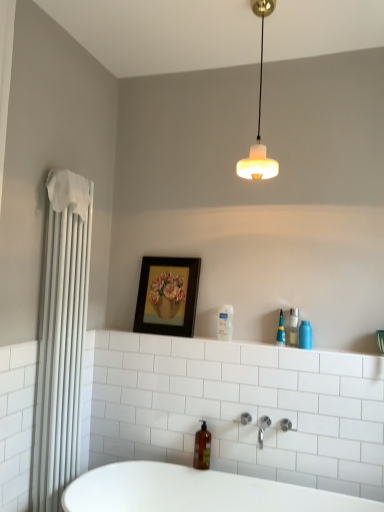
Measure the distance between silver metallic faucet at lower center and camera.

silver metallic faucet at lower center and camera are 2.18 meters apart from each other.

Image resolution: width=384 pixels, height=512 pixels. I want to click on blue glossy bottle at upper right, placed as the fourth toiletry when sorted from left to right, so click(x=305, y=335).

Measure the distance between clear plastic bottle at center, the 4th toiletry in the right-to-left sequence, and camera.

clear plastic bottle at center, the 4th toiletry in the right-to-left sequence, and camera are 2.31 meters apart from each other.

The image size is (384, 512). Describe the element at coordinates (61, 337) in the screenshot. I see `white fabric towel at left` at that location.

Image resolution: width=384 pixels, height=512 pixels. Describe the element at coordinates (259, 117) in the screenshot. I see `white frosted glass lampshade at upper center` at that location.

Locate an element on the screen. The height and width of the screenshot is (512, 384). silver metallic faucet at lower center is located at coordinates (263, 429).

Can you confirm if white frosted glass lampshade at upper center is shorter than translucent plastic pen at upper right, the 3th toiletry positioned from the right?

In fact, white frosted glass lampshade at upper center may be taller than translucent plastic pen at upper right, the 3th toiletry positioned from the right.

Considering the positions of points (261, 160) and (280, 324), is point (261, 160) closer to camera compared to point (280, 324)?

That is True.

Can you confirm if white frosted glass lampshade at upper center is thinner than translucent plastic pen at upper right, placed as the second toiletry when sorted from left to right?

No.

From a real-world perspective, is white frosted glass lampshade at upper center below translucent plastic pen at upper right, placed as the second toiletry when sorted from left to right?

Actually, white frosted glass lampshade at upper center is physically above translucent plastic pen at upper right, placed as the second toiletry when sorted from left to right, in the real world.

From a real-world perspective, which is physically above, translucent plastic pen at upper right, placed as the second toiletry when sorted from left to right, or silver metallic faucet at lower center?

translucent plastic pen at upper right, placed as the second toiletry when sorted from left to right.

Identify the location of tap on the left of translucent plastic pen at upper right, the 3th toiletry positioned from the right. This screenshot has width=384, height=512. (263, 429).

Is translucent plastic pen at upper right, the 3th toiletry positioned from the right, placed right next to silver metallic faucet at lower center?

No, translucent plastic pen at upper right, the 3th toiletry positioned from the right, is not next to silver metallic faucet at lower center.

From the image's perspective, between translucent plastic pen at upper right, the 3th toiletry positioned from the right, and silver metallic faucet at lower center, who is located below?

silver metallic faucet at lower center is shown below in the image.

Is white fabric towel at left taller or shorter than clear glass bottle at upper right, which is the third toiletry from left to right?

Clearly, white fabric towel at left is taller compared to clear glass bottle at upper right, which is the third toiletry from left to right.

Is point (50, 356) behind point (296, 313)?

No, it is in front of (296, 313).

Is white fabric towel at left completely or partially outside of clear glass bottle at upper right, which is the third toiletry from left to right?

white fabric towel at left lies outside clear glass bottle at upper right, which is the third toiletry from left to right,'s area.

Which of these two, white fabric towel at left or clear glass bottle at upper right, marked as the second toiletry in a right-to-left arrangement, is wider?

white fabric towel at left is wider.

Which object is positioned more to the right, clear glass bottle at upper right, marked as the second toiletry in a right-to-left arrangement, or silver metallic faucet at lower center?

Positioned to the right is clear glass bottle at upper right, marked as the second toiletry in a right-to-left arrangement.

Can you confirm if clear glass bottle at upper right, marked as the second toiletry in a right-to-left arrangement, is taller than silver metallic faucet at lower center?

Indeed, clear glass bottle at upper right, marked as the second toiletry in a right-to-left arrangement, has a greater height compared to silver metallic faucet at lower center.

Between clear glass bottle at upper right, marked as the second toiletry in a right-to-left arrangement, and silver metallic faucet at lower center, which one has smaller size?

Smaller between the two is clear glass bottle at upper right, marked as the second toiletry in a right-to-left arrangement.

Who is bigger, brown glass soap dispenser at lower center or white frosted glass lampshade at upper center?

white frosted glass lampshade at upper center is bigger.

Identify the location of lamp positioned vertically above the brown glass soap dispenser at lower center (from a real-world perspective). The height and width of the screenshot is (512, 384). (259, 117).

From a real-world perspective, which is physically above, brown glass soap dispenser at lower center or white frosted glass lampshade at upper center?

white frosted glass lampshade at upper center.

Does brown glass soap dispenser at lower center lie in front of white frosted glass lampshade at upper center?

No, brown glass soap dispenser at lower center is behind white frosted glass lampshade at upper center.

Is point (297, 308) less distant than point (229, 313)?

That is True.

Starting from the clear plastic bottle at center, the 4th toiletry in the right-to-left sequence, which toiletry is the 2nd one to the right? Please provide its 2D coordinates.

[(293, 327)]

From a real-world perspective, is clear glass bottle at upper right, which is the third toiletry from left to right, above or below clear plastic bottle at center, the first toiletry when ordered from left to right?

clear glass bottle at upper right, which is the third toiletry from left to right, is situated lower than clear plastic bottle at center, the first toiletry when ordered from left to right, in the real world.

Considering the relative sizes of clear glass bottle at upper right, marked as the second toiletry in a right-to-left arrangement, and clear plastic bottle at center, the first toiletry when ordered from left to right, in the image provided, is clear glass bottle at upper right, marked as the second toiletry in a right-to-left arrangement, thinner than clear plastic bottle at center, the first toiletry when ordered from left to right,?

No.

This screenshot has height=512, width=384. I want to click on the 3rd toiletry behind the white fabric towel at left, so [281, 331].

Which point is more distant from viewer, (x=281, y=337) or (x=66, y=298)?

Point (x=281, y=337)

Is the surface of translucent plastic pen at upper right, placed as the second toiletry when sorted from left to right, in direct contact with white fabric towel at left?

No, translucent plastic pen at upper right, placed as the second toiletry when sorted from left to right, is not making contact with white fabric towel at left.

Does translucent plastic pen at upper right, the 3th toiletry positioned from the right, have a larger size compared to white fabric towel at left?

No.

You are a GUI agent. You are given a task and a screenshot of the screen. Output one action in this format:
    pyautogui.click(x=<x>, y=<y>)
    Task: Click on the lamp on the left side of translucent plastic pen at upper right, the 3th toiletry positioned from the right
    Image resolution: width=384 pixels, height=512 pixels.
    Given the screenshot: What is the action you would take?
    pyautogui.click(x=259, y=117)

Find the location of a particular element. This screenshot has width=384, height=512. the 3rd toiletry above the silver metallic faucet at lower center (from a real-world perspective) is located at coordinates (281, 331).

Based on the photo, considering their positions, is clear plastic bottle at center, the first toiletry when ordered from left to right, positioned further to wooden framed painting at center than white fabric towel at left?

white fabric towel at left is further to wooden framed painting at center.

Estimate the real-world distances between objects in this image. Which object is further from white fabric towel at left, clear glass bottle at upper right, which is the third toiletry from left to right, or white glossy bathtub at lower center?

clear glass bottle at upper right, which is the third toiletry from left to right, is further to white fabric towel at left.

From the image, which object appears to be farther from white glossy bathtub at lower center, silver metallic faucet at lower center or white fabric towel at left?

white fabric towel at left lies further to white glossy bathtub at lower center than the other object.

Considering their positions, is white frosted glass lampshade at upper center positioned closer to white fabric towel at left than blue glossy bottle at upper right, acting as the first toiletry starting from the right?

Among the two, white frosted glass lampshade at upper center is located nearer to white fabric towel at left.

From the picture: From the image, which object appears to be farther from white fabric towel at left, clear plastic bottle at center, the 4th toiletry in the right-to-left sequence, or silver metallic faucet at lower center?

Among the two, silver metallic faucet at lower center is located further to white fabric towel at left.

From the image, which object appears to be farther from white fabric towel at left, white frosted glass lampshade at upper center or clear glass bottle at upper right, marked as the second toiletry in a right-to-left arrangement?

Among the two, clear glass bottle at upper right, marked as the second toiletry in a right-to-left arrangement, is located further to white fabric towel at left.

Estimate the real-world distances between objects in this image. Which object is further from white glossy bathtub at lower center, clear glass bottle at upper right, which is the third toiletry from left to right, or translucent plastic pen at upper right, the 3th toiletry positioned from the right?

clear glass bottle at upper right, which is the third toiletry from left to right.

Which object lies further to the anchor point blue glossy bottle at upper right, placed as the fourth toiletry when sorted from left to right, translucent plastic pen at upper right, the 3th toiletry positioned from the right, or white fabric towel at left?

white fabric towel at left.

Where is `picture frame between white fabric towel at left and blue glossy bottle at upper right, acting as the first toiletry starting from the right`? The height and width of the screenshot is (512, 384). picture frame between white fabric towel at left and blue glossy bottle at upper right, acting as the first toiletry starting from the right is located at coordinates (168, 296).

This screenshot has height=512, width=384. In order to click on tap located between white glossy bathtub at lower center and clear plastic bottle at center, the first toiletry when ordered from left to right, in the depth direction in this screenshot , I will do `click(263, 429)`.

Find the location of a particular element. picture frame between white frosted glass lampshade at upper center and brown glass soap dispenser at lower center vertically is located at coordinates (168, 296).

The height and width of the screenshot is (512, 384). I want to click on tap between white glossy bathtub at lower center and brown glass soap dispenser at lower center along the z-axis, so click(263, 429).